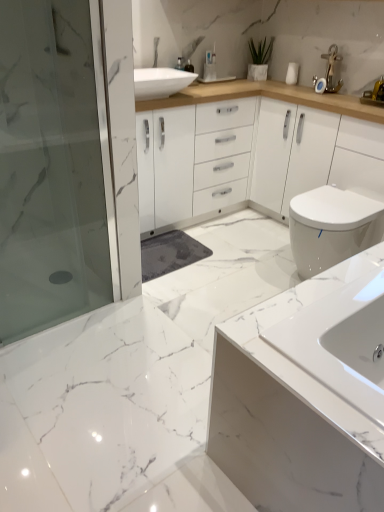
What do you see at coordinates (291, 413) in the screenshot? I see `white glossy sink at lower right` at bounding box center [291, 413].

This screenshot has width=384, height=512. I want to click on white glossy sink at lower right, so 291,413.

Find the location of `white glossy sink at lower right`. white glossy sink at lower right is located at coordinates (291, 413).

Considering the sizes of objects green matte plant at upper center and white glossy toilet at right in the image provided, who is wider, green matte plant at upper center or white glossy toilet at right?

white glossy toilet at right is wider.

How many degrees apart are the facing directions of green matte plant at upper center and white glossy toilet at right?

The angular difference between green matte plant at upper center and white glossy toilet at right is 75 degrees.

Who is bigger, green matte plant at upper center or white glossy toilet at right?

white glossy toilet at right.

From the image's perspective, is green matte plant at upper center above or below white glossy toilet at right?

Clearly, from the image's perspective, green matte plant at upper center is above white glossy toilet at right.

Can you confirm if transparent glass shower door at left is wider than white glossy toilet at right?

No, transparent glass shower door at left is not wider than white glossy toilet at right.

Between point (38, 135) and point (320, 209), which one is positioned in front?

Positioned in front is point (320, 209).

Is transparent glass shower door at left positioned with its back to white glossy toilet at right?

No, white glossy toilet at right is not at the back of transparent glass shower door at left.

Is transparent glass shower door at left positioned behind white glossy toilet at right?

That is False.

Is point (335, 451) in front of point (64, 71)?

Yes.

What's the angular difference between white glossy sink at lower right and transparent glass shower door at left's facing directions?

There is a 177-degree angle between the facing directions of white glossy sink at lower right and transparent glass shower door at left.

Locate an element on the screen. Image resolution: width=384 pixels, height=512 pixels. bathroom cabinet on the right of transparent glass shower door at left is located at coordinates (291, 413).

From the image's perspective, is white glossy sink at lower right beneath transparent glass shower door at left?

Yes.

Does point (327, 418) appear closer or farther from the camera than point (346, 218)?

Clearly, point (327, 418) is closer to the camera than point (346, 218).

At what (x,y) coordinates should I click in order to perform the action: click on bathroom cabinet below the white glossy toilet at right (from the image's perspective). Please return your answer as a coordinate pair (x, y). This screenshot has height=512, width=384. Looking at the image, I should click on (291, 413).

Is white glossy sink at lower right shorter than white glossy toilet at right?

Incorrect, the height of white glossy sink at lower right does not fall short of that of white glossy toilet at right.

Does white glossy sink at lower right have a smaller size compared to white glossy toilet at right?

Actually, white glossy sink at lower right might be larger than white glossy toilet at right.

Between point (359, 448) and point (269, 54), which one is positioned behind?

The point (269, 54) is more distant.

Does white glossy sink at lower right have a greater height compared to green matte plant at upper center?

Yes.

From a real-world perspective, which is physically below, white glossy sink at lower right or green matte plant at upper center?

From a 3D spatial view, white glossy sink at lower right is below.

Is the depth of white glossy sink at lower right less than that of green matte plant at upper center?

Yes, white glossy sink at lower right is in front of green matte plant at upper center.

Does green matte plant at upper center appear on the left side of white glossy sink at lower right?

Indeed, green matte plant at upper center is positioned on the left side of white glossy sink at lower right.

From a real-world perspective, is green matte plant at upper center beneath white glossy sink at lower right?

No.

Can you confirm if green matte plant at upper center is smaller than white glossy sink at lower right?

Correct, green matte plant at upper center occupies less space than white glossy sink at lower right.

Which of these two, green matte plant at upper center or white glossy sink at lower right, stands shorter?

green matte plant at upper center.

Does white glossy toilet at right touch transparent glass shower door at left?

No, white glossy toilet at right is not beside transparent glass shower door at left.

Is white glossy toilet at right taller than transparent glass shower door at left?

No, white glossy toilet at right is not taller than transparent glass shower door at left.

From the image's perspective, which is above, white glossy toilet at right or transparent glass shower door at left?

From the image's view, transparent glass shower door at left is above.

Considering their positions, is white glossy toilet at right located in front of or behind transparent glass shower door at left?

Clearly, white glossy toilet at right is behind transparent glass shower door at left.

This screenshot has height=512, width=384. What are the coordinates of `toilet that is below the green matte plant at upper center (from the image's perspective)` in the screenshot? It's located at (332, 227).

You are a GUI agent. You are given a task and a screenshot of the screen. Output one action in this format:
    pyautogui.click(x=<x>, y=<y>)
    Task: Click on the toilet lying behind the transparent glass shower door at left
    
    Given the screenshot: What is the action you would take?
    pyautogui.click(x=332, y=227)

When comparing their distances from green matte plant at upper center, does white glossy sink at lower right or white glossy toilet at right seem closer?

white glossy toilet at right is positioned closer to the anchor green matte plant at upper center.

From the image, which object appears to be farther from green matte plant at upper center, white glossy toilet at right or transparent glass shower door at left?

transparent glass shower door at left lies further to green matte plant at upper center than the other object.

Looking at the image, which one is located further to white glossy sink at lower right, white glossy toilet at right or transparent glass shower door at left?

Based on the image, transparent glass shower door at left appears to be further to white glossy sink at lower right.

Considering their positions, is transparent glass shower door at left positioned further to green matte plant at upper center than white glossy sink at lower right?

Among the two, white glossy sink at lower right is located further to green matte plant at upper center.

Based on their spatial positions, is white glossy sink at lower right or white glossy toilet at right closer to transparent glass shower door at left?

The object closer to transparent glass shower door at left is white glossy toilet at right.

When comparing their distances from green matte plant at upper center, does transparent glass shower door at left or white glossy toilet at right seem further?

Based on the image, transparent glass shower door at left appears to be further to green matte plant at upper center.

Based on their spatial positions, is white glossy toilet at right or green matte plant at upper center further from white glossy sink at lower right?

green matte plant at upper center is further to white glossy sink at lower right.

Which object lies further to the anchor point white glossy sink at lower right, green matte plant at upper center or white glossy toilet at right?

green matte plant at upper center is positioned further to the anchor white glossy sink at lower right.

I want to click on toilet between transparent glass shower door at left and green matte plant at upper center along the z-axis, so click(332, 227).

Where is `bathroom cabinet between transparent glass shower door at left and white glossy toilet at right in the horizontal direction`? bathroom cabinet between transparent glass shower door at left and white glossy toilet at right in the horizontal direction is located at coordinates (291, 413).

Locate an element on the screen. shower door located between white glossy sink at lower right and green matte plant at upper center in the depth direction is located at coordinates (49, 168).

I want to click on toilet between white glossy sink at lower right and green matte plant at upper center along the z-axis, so click(332, 227).